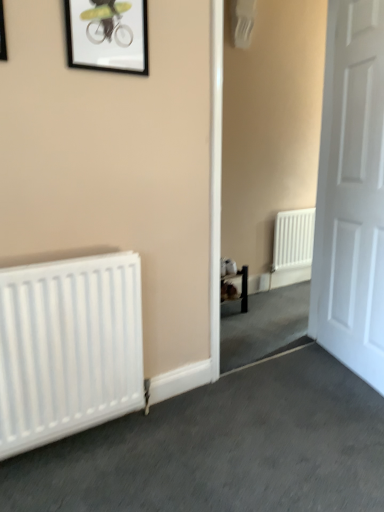
Question: Considering their positions, is white matte door at right located in front of or behind matte black picture frame at upper left, which ranks as the 1th picture frame in front-to-back order?

Choices:
 (A) front
 (B) behind

Answer: (B)

Question: Considering the positions of white matte door at right and matte black picture frame at upper left, the 2th picture frame when ordered from back to front, in the image, is white matte door at right wider or thinner than matte black picture frame at upper left, the 2th picture frame when ordered from back to front,?

Choices:
 (A) wide
 (B) thin

Answer: (A)

Question: Estimate the real-world distances between objects in this image. Which object is closer to the white matte radiator at left?

Choices:
 (A) matte black picture frame at upper left, the 2th picture frame when ordered from back to front
 (B) white matte door at right
 (C) black matte picture frame at upper center, which ranks as the 2th picture frame in left-to-right order

Answer: (C)

Question: Which object is positioned farthest from the black matte picture frame at upper center, which is counted as the first picture frame, starting from the right?

Choices:
 (A) white matte door at right
 (B) white matte radiator at left
 (C) matte black picture frame at upper left, the 1th picture frame in the left-to-right sequence

Answer: (A)